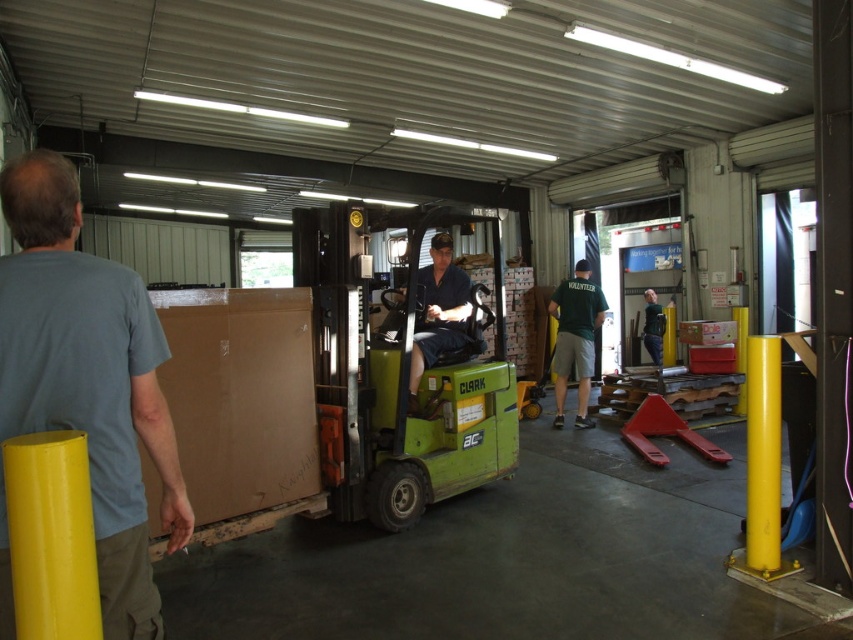
Looking at this image, you are a warehouse manager checking the safety of clothing materials. You notice two shirts in the scene. Which shirt has a thicker material, the gray cotton shirt at left or the green fabric shirt at center?

→ The green fabric shirt at center is thicker than the gray cotton shirt at left.

You are a warehouse supervisor checking the height of workers for safety gear requirements. The safety gear must be adjusted based on the worker height. Which worker, the gray cotton shirt at left or the green fabric shirt at center, requires a taller safety gear adjustment?

The gray cotton shirt at left requires a taller safety gear adjustment because it is much taller than the green fabric shirt at center.

In the scene shown: You are an inspector in this warehouse and need to determine if the green cotton shirt at center is visible from above the green fabric shirt at center. Based on their positions, can you see it?

The green cotton shirt at center is positioned under the green fabric shirt at center, so it is not visible from above.